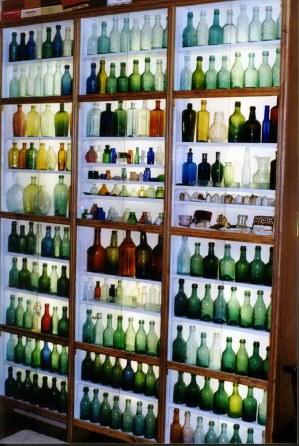
Locate an element on the screen. This screenshot has height=446, width=299. divisions between two shelving units is located at coordinates (170, 54), (72, 233).